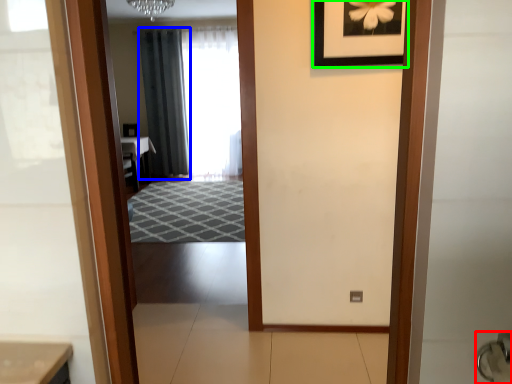
Question: Which object is the farthest from door handle (highlighted by a red box)? Choose among these: curtain (highlighted by a blue box) or picture frame (highlighted by a green box).

Choices:
 (A) curtain
 (B) picture frame

Answer: (A)